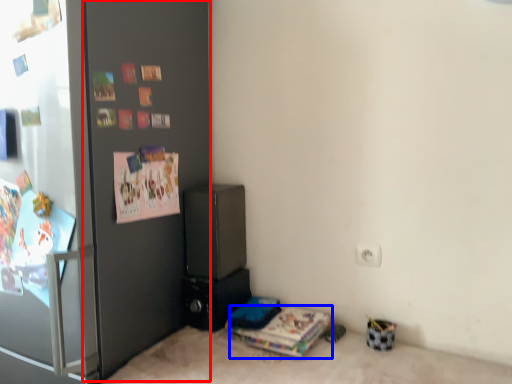
Question: Which point is closer to the camera, door (highlighted by a red box) or magazine (highlighted by a blue box)?

Choices:
 (A) door
 (B) magazine

Answer: (A)